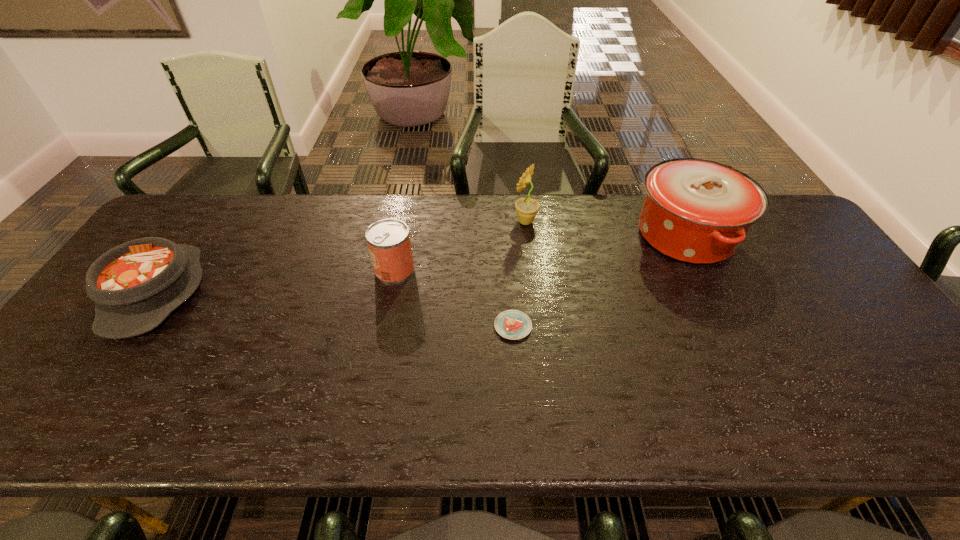
This screenshot has height=540, width=960. I want to click on vacant point located between the fourth tallest object and the sunflower, so click(x=341, y=258).

The height and width of the screenshot is (540, 960). In order to click on empty space that is in between the can and the right casserole in this screenshot , I will do `click(540, 252)`.

Locate an element on the screen. The height and width of the screenshot is (540, 960). free point between the sunflower and the pastry is located at coordinates (519, 274).

I want to click on empty space that is in between the leftmost object and the pastry, so click(x=334, y=310).

Locate an element on the screen. The image size is (960, 540). free space between the pastry and the fourth tallest object is located at coordinates (334, 310).

Locate which object is the second closest to the sunflower. Please provide its 2D coordinates. Your answer should be formatted as a tuple, i.e. [(x, y)], where the tuple contains the x and y coordinates of a point satisfying the conditions above.

[(388, 240)]

Point out which object is positioned as the third nearest to the second object from left to right. Please provide its 2D coordinates. Your answer should be formatted as a tuple, i.e. [(x, y)], where the tuple contains the x and y coordinates of a point satisfying the conditions above.

[(135, 286)]

Where is `free location that satisfies the following two spatial constraints: 1. on the face of the sunflower; 2. on the left side of the taller casserole`? free location that satisfies the following two spatial constraints: 1. on the face of the sunflower; 2. on the left side of the taller casserole is located at coordinates (527, 235).

You are a GUI agent. You are given a task and a screenshot of the screen. Output one action in this format:
    pyautogui.click(x=<x>, y=<y>)
    Task: Click on the free space that satisfies the following two spatial constraints: 1. on the face of the sunflower; 2. on the front side of the shorter casserole
    This screenshot has height=540, width=960.
    Given the screenshot: What is the action you would take?
    pyautogui.click(x=534, y=293)

Where is `vacant space that satisfies the following two spatial constraints: 1. on the back side of the third shortest object; 2. on the right side of the taller casserole`? The height and width of the screenshot is (540, 960). vacant space that satisfies the following two spatial constraints: 1. on the back side of the third shortest object; 2. on the right side of the taller casserole is located at coordinates (401, 235).